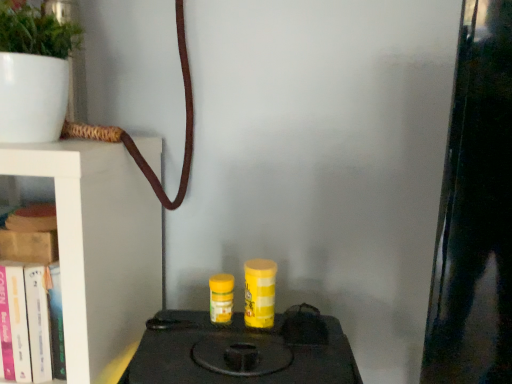
What do you see at coordinates (33, 73) in the screenshot? This screenshot has height=384, width=512. I see `white matte pot at upper left` at bounding box center [33, 73].

In order to face hardcover book at left, marked as the 1th book in a bottom-to-top arrangement, should I rotate leftwards or rightwards?

Turn left by 30.254 degrees to look at hardcover book at left, marked as the 1th book in a bottom-to-top arrangement.

Locate an element on the screen. wooden book at left, acting as the 2th book starting from the bottom is located at coordinates (33, 218).

Which of these two, black matte stove at center or hardcover book at left, marked as the 1th book in a bottom-to-top arrangement, stands taller?

Standing taller between the two is black matte stove at center.

From a real-world perspective, who is located higher, black matte stove at center or hardcover book at left, acting as the second book starting from the top?

hardcover book at left, acting as the second book starting from the top, from a real-world perspective.

From the image's perspective, is black matte stove at center above hardcover book at left, acting as the second book starting from the top?

No, from the image's perspective, black matte stove at center is not over hardcover book at left, acting as the second book starting from the top.

Is black matte stove at center not near hardcover book at left, marked as the 1th book in a bottom-to-top arrangement?

No, black matte stove at center is not far away from hardcover book at left, marked as the 1th book in a bottom-to-top arrangement.

Is white matte pot at upper left shorter than hardcover book at left, acting as the second book starting from the top?

In fact, white matte pot at upper left may be taller than hardcover book at left, acting as the second book starting from the top.

Which object is thinner, white matte pot at upper left or hardcover book at left, acting as the second book starting from the top?

hardcover book at left, acting as the second book starting from the top, is thinner.

Based on their sizes in the image, would you say white matte pot at upper left is bigger or smaller than hardcover book at left, marked as the 1th book in a bottom-to-top arrangement?

In the image, white matte pot at upper left appears to be larger than hardcover book at left, marked as the 1th book in a bottom-to-top arrangement.

Between wooden book at left, acting as the 2th book starting from the bottom, and hardcover book at left, marked as the 1th book in a bottom-to-top arrangement, which one has smaller size?

wooden book at left, acting as the 2th book starting from the bottom.

At what (x,y) coordinates should I click in order to perform the action: click on book below the wooden book at left, which is counted as the 1th book, starting from the top (from the image's perspective). Please return your answer as a coordinate pair (x, y). The width and height of the screenshot is (512, 384). Looking at the image, I should click on (31, 299).

Is the position of wooden book at left, acting as the 2th book starting from the bottom, more distant than that of hardcover book at left, acting as the second book starting from the top?

Yes, it is behind hardcover book at left, acting as the second book starting from the top.

Is wooden book at left, acting as the 2th book starting from the bottom, positioned far away from hardcover book at left, acting as the second book starting from the top?

No, wooden book at left, acting as the 2th book starting from the bottom, is not far away from hardcover book at left, acting as the second book starting from the top.

In the image, is hardcover book at left, acting as the second book starting from the top, on the left side or the right side of wooden book at left, acting as the 2th book starting from the bottom?

Clearly, hardcover book at left, acting as the second book starting from the top, is on the left of wooden book at left, acting as the 2th book starting from the bottom, in the image.

Consider the image. Between hardcover book at left, marked as the 1th book in a bottom-to-top arrangement, and wooden book at left, which is counted as the 1th book, starting from the top, which one has larger size?

hardcover book at left, marked as the 1th book in a bottom-to-top arrangement.

What's the angular difference between hardcover book at left, marked as the 1th book in a bottom-to-top arrangement, and wooden book at left, acting as the 2th book starting from the bottom,'s facing directions?

The angle between the facing direction of hardcover book at left, marked as the 1th book in a bottom-to-top arrangement, and the facing direction of wooden book at left, acting as the 2th book starting from the bottom, is 0.00125 degrees.

Is hardcover book at left, acting as the second book starting from the top, wider or thinner than wooden book at left, acting as the 2th book starting from the bottom?

Considering their sizes, hardcover book at left, acting as the second book starting from the top, looks broader than wooden book at left, acting as the 2th book starting from the bottom.

Is wooden book at left, acting as the 2th book starting from the bottom, positioned before white matte pot at upper left?

No, the depth of wooden book at left, acting as the 2th book starting from the bottom, is greater than that of white matte pot at upper left.

Does wooden book at left, which is counted as the 1th book, starting from the top, appear on the right side of white matte pot at upper left?

Yes.

Considering the relative sizes of wooden book at left, acting as the 2th book starting from the bottom, and white matte pot at upper left in the image provided, is wooden book at left, acting as the 2th book starting from the bottom, taller than white matte pot at upper left?

No.

Consider the image. Which of these two, hardcover book at left, marked as the 1th book in a bottom-to-top arrangement, or white matte pot at upper left, stands shorter?

With less height is hardcover book at left, marked as the 1th book in a bottom-to-top arrangement.

Which object is closer to the camera, hardcover book at left, marked as the 1th book in a bottom-to-top arrangement, or white matte pot at upper left?

white matte pot at upper left is closer to the camera.

From the image's perspective, which object appears higher, hardcover book at left, marked as the 1th book in a bottom-to-top arrangement, or white matte pot at upper left?

white matte pot at upper left.

How many degrees apart are the facing directions of hardcover book at left, marked as the 1th book in a bottom-to-top arrangement, and white matte pot at upper left?

There is a 1.11-degree angle between the facing directions of hardcover book at left, marked as the 1th book in a bottom-to-top arrangement, and white matte pot at upper left.

Is wooden book at left, which is counted as the 1th book, starting from the top, shorter than black matte stove at center?

Yes.

Who is smaller, wooden book at left, which is counted as the 1th book, starting from the top, or black matte stove at center?

Smaller between the two is wooden book at left, which is counted as the 1th book, starting from the top.

Looking at this image, would you say wooden book at left, which is counted as the 1th book, starting from the top, is to the left or to the right of black matte stove at center in the picture?

wooden book at left, which is counted as the 1th book, starting from the top, is to the left of black matte stove at center.

From a real-world perspective, between wooden book at left, acting as the 2th book starting from the bottom, and black matte stove at center, who is vertically higher?

wooden book at left, acting as the 2th book starting from the bottom, is physically above.

You are a GUI agent. You are given a task and a screenshot of the screen. Output one action in this format:
    pyautogui.click(x=<x>, y=<y>)
    Task: Click on the stove located on the right of hardcover book at left, acting as the second book starting from the top
    This screenshot has height=384, width=512.
    Given the screenshot: What is the action you would take?
    pyautogui.click(x=243, y=350)

You are a GUI agent. You are given a task and a screenshot of the screen. Output one action in this format:
    pyautogui.click(x=<x>, y=<y>)
    Task: Click on the 1st book behind the white matte pot at upper left, starting your count from the anchor
    This screenshot has height=384, width=512.
    Given the screenshot: What is the action you would take?
    pyautogui.click(x=31, y=299)

Considering their positions, is hardcover book at left, marked as the 1th book in a bottom-to-top arrangement, positioned further to white matte pot at upper left than black matte stove at center?

Result: Based on the image, black matte stove at center appears to be further to white matte pot at upper left.

From the image, which object appears to be farther from black matte stove at center, hardcover book at left, marked as the 1th book in a bottom-to-top arrangement, or white matte pot at upper left?

white matte pot at upper left.

When comparing their distances from wooden book at left, which is counted as the 1th book, starting from the top, does black matte stove at center or hardcover book at left, marked as the 1th book in a bottom-to-top arrangement, seem closer?

hardcover book at left, marked as the 1th book in a bottom-to-top arrangement, lies closer to wooden book at left, which is counted as the 1th book, starting from the top, than the other object.

Estimate the real-world distances between objects in this image. Which object is closer to white matte pot at upper left, black matte stove at center or hardcover book at left, marked as the 1th book in a bottom-to-top arrangement?

hardcover book at left, marked as the 1th book in a bottom-to-top arrangement.

Considering their positions, is white matte pot at upper left positioned further to black matte stove at center than wooden book at left, acting as the 2th book starting from the bottom?

white matte pot at upper left lies further to black matte stove at center than the other object.

Which object lies nearer to the anchor point wooden book at left, acting as the 2th book starting from the bottom, hardcover book at left, marked as the 1th book in a bottom-to-top arrangement, or black matte stove at center?

hardcover book at left, marked as the 1th book in a bottom-to-top arrangement, lies closer to wooden book at left, acting as the 2th book starting from the bottom, than the other object.

When comparing their distances from hardcover book at left, marked as the 1th book in a bottom-to-top arrangement, does white matte pot at upper left or black matte stove at center seem closer?

The object closer to hardcover book at left, marked as the 1th book in a bottom-to-top arrangement, is white matte pot at upper left.

Considering their positions, is white matte pot at upper left positioned closer to hardcover book at left, marked as the 1th book in a bottom-to-top arrangement, than wooden book at left, which is counted as the 1th book, starting from the top?

Based on the image, wooden book at left, which is counted as the 1th book, starting from the top, appears to be nearer to hardcover book at left, marked as the 1th book in a bottom-to-top arrangement.

In order to click on book between white matte pot at upper left and hardcover book at left, acting as the second book starting from the top, vertically in this screenshot , I will do `click(33, 218)`.

The image size is (512, 384). What are the coordinates of `book between hardcover book at left, marked as the 1th book in a bottom-to-top arrangement, and black matte stove at center from left to right` in the screenshot? It's located at (33, 218).